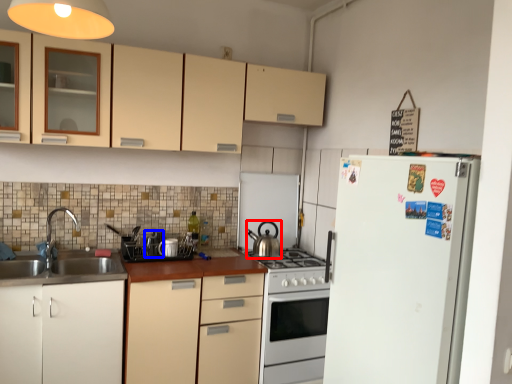
Question: Which object appears closest to the camera in this image, kitchen appliance (highlighted by a red box) or appliance (highlighted by a blue box)?

Choices:
 (A) kitchen appliance
 (B) appliance

Answer: (B)